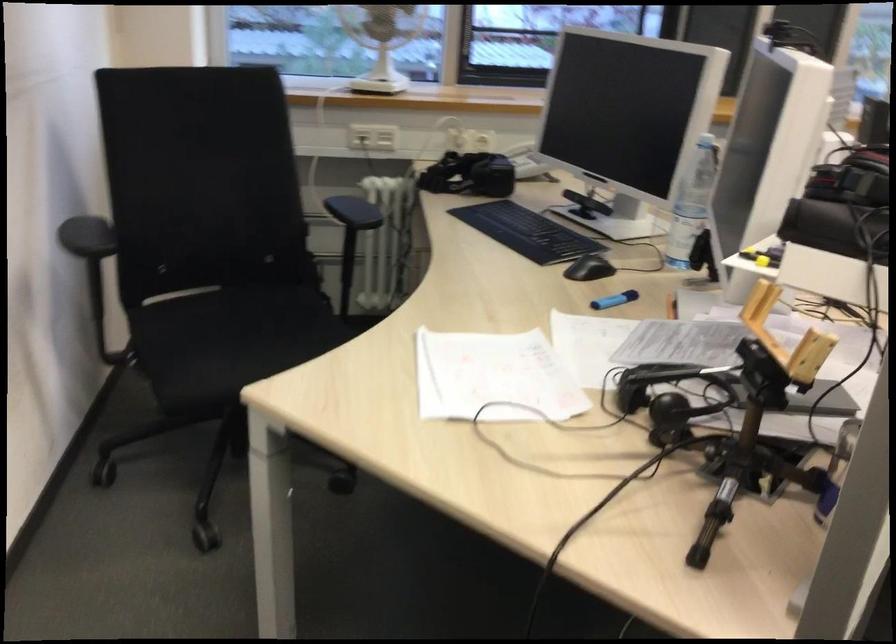
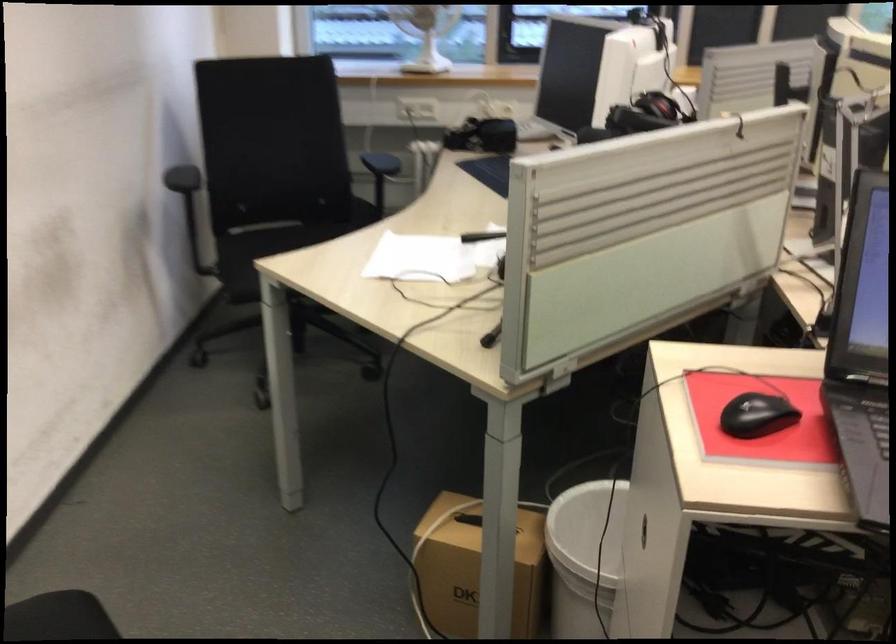
Question: I am providing you with two images of the same scene from different viewpoints. After the viewpoint changes to image2, which objects are now occluded?

Choices:
 (A) brown cardboard box
 (B) gray cabinet handle
 (C) black chair armrest
 (D) telephone handset

Answer: (D)